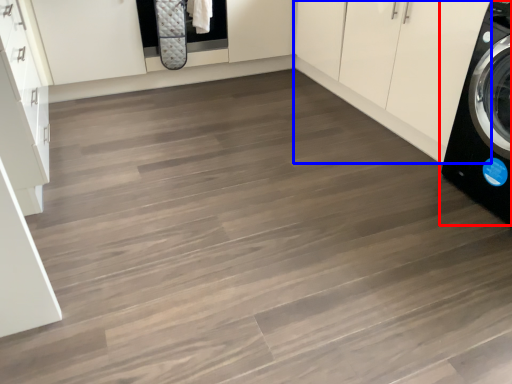
Question: Which point is further to the camera, washing machine (highlighted by a red box) or cabinetry (highlighted by a blue box)?

Choices:
 (A) washing machine
 (B) cabinetry

Answer: (B)